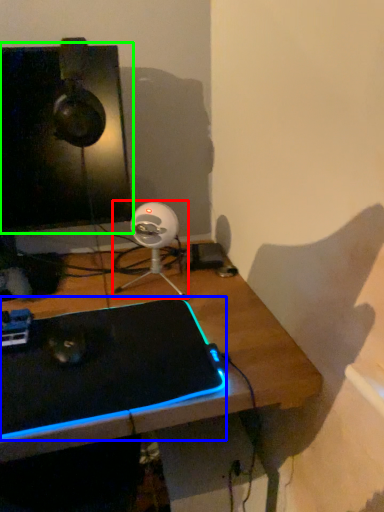
Question: Based on their relative distances, which object is nearer to fan (highlighted by a red box)? Choose from laptop (highlighted by a blue box) and computer monitor (highlighted by a green box).

Choices:
 (A) laptop
 (B) computer monitor

Answer: (B)